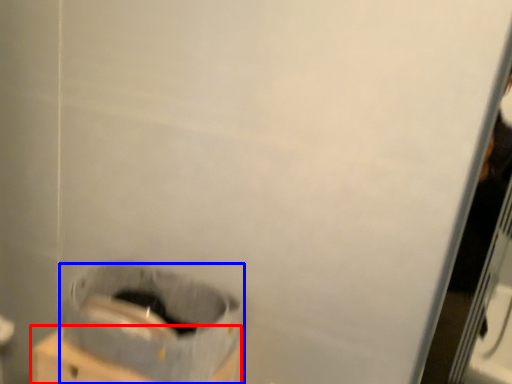
Question: Which object is closer to the camera taking this photo, cardboard box (highlighted by a red box) or waste container (highlighted by a blue box)?

Choices:
 (A) cardboard box
 (B) waste container

Answer: (B)